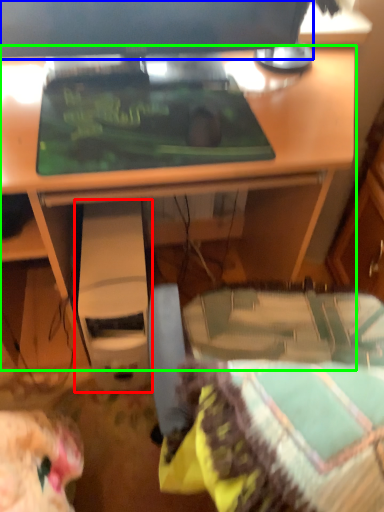
Question: Based on their relative distances, which object is nearer to computer (highlighted by a red box)? Choose from computer monitor (highlighted by a blue box) and desk (highlighted by a green box).

Choices:
 (A) computer monitor
 (B) desk

Answer: (B)